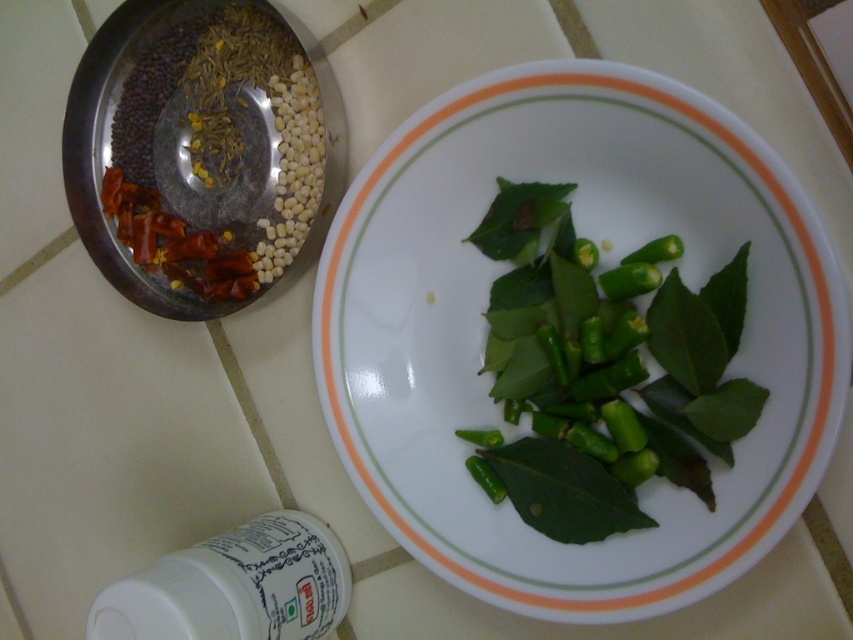
Which is below, white glossy plate at center or green matte leaves at center?

green matte leaves at center is below.

Who is taller, white glossy plate at center or green matte leaves at center?

With more height is white glossy plate at center.

The width and height of the screenshot is (853, 640). What do you see at coordinates (602, 262) in the screenshot? I see `white glossy plate at center` at bounding box center [602, 262].

Where is `white glossy plate at center`? The height and width of the screenshot is (640, 853). white glossy plate at center is located at coordinates (602, 262).

Is point (399, 408) less distant than point (264, 138)?

That is True.

You are a GUI agent. You are given a task and a screenshot of the screen. Output one action in this format:
    pyautogui.click(x=<x>, y=<y>)
    Task: Click on the white glossy plate at center
    
    Given the screenshot: What is the action you would take?
    pyautogui.click(x=602, y=262)

Does green matte leaves at center have a smaller size compared to metallic bowl at upper left?

Yes, green matte leaves at center is smaller than metallic bowl at upper left.

Between point (514, 234) and point (202, 116), which one is positioned in front?

Positioned in front is point (514, 234).

Does point (643, 428) come farther from viewer compared to point (135, 189)?

That is False.

Locate an element on the screen. The image size is (853, 640). green matte leaves at center is located at coordinates (602, 371).